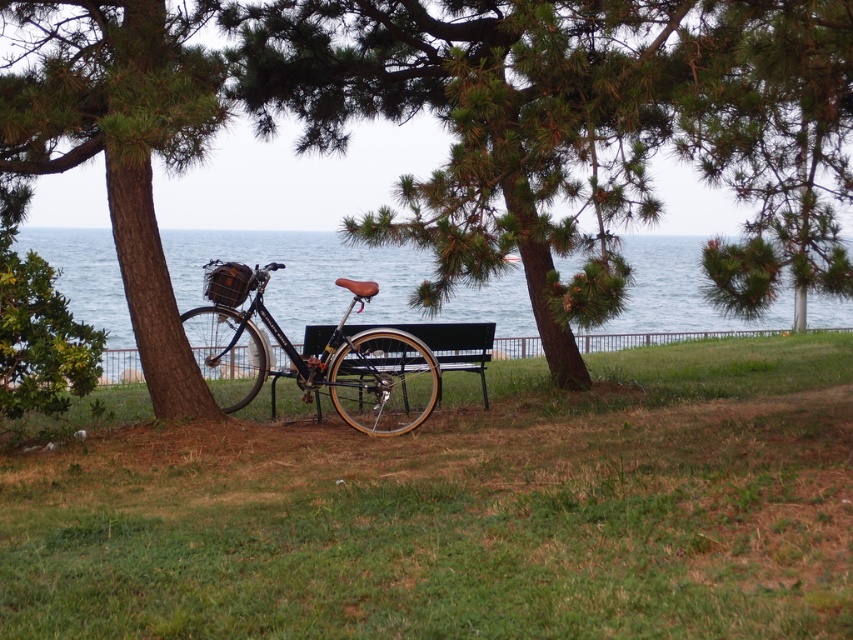
Question: Among these points, which one is nearest to the camera?

Choices:
 (A) (454, 323)
 (B) (241, 72)
 (C) (683, 292)
 (D) (741, 472)

Answer: (D)

Question: Among these objects, which one is nearest to the camera?

Choices:
 (A) green grass at center
 (B) green textured tree trunk at left
 (C) black metal bench at center

Answer: (A)

Question: Is green textured tree trunk at left above blue water at center?

Choices:
 (A) no
 (B) yes

Answer: (B)

Question: Among these points, which one is farthest from the camera?

Choices:
 (A) [103, 154]
 (B) [672, 305]

Answer: (B)

Question: Considering the relative positions of green grass at center and black metal bench at center in the image provided, where is green grass at center located with respect to black metal bench at center?

Choices:
 (A) below
 (B) above

Answer: (A)

Question: Is green grass at center bigger than shiny black bicycle at center?

Choices:
 (A) yes
 (B) no

Answer: (A)